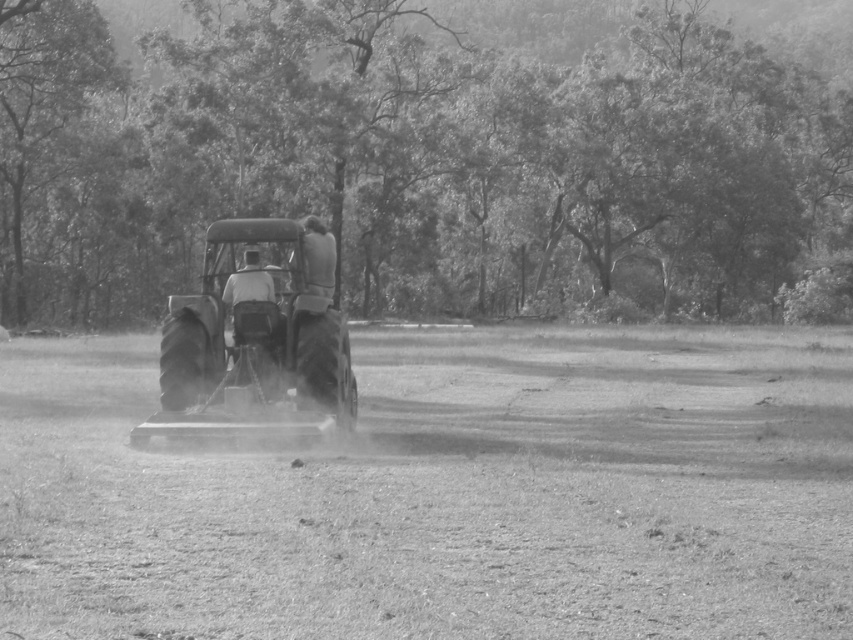
You are a farmer standing at the edge of your field. You see the metallic tractor at center and the dusty soil at center. Which object is taller from your viewpoint?

The metallic tractor at center is taller than the dusty soil at center.

From the picture: You are standing in the field and want to take a photo of the metallic tractor at center. If your camera has a maximum focus range of 40 feet, will you need to move closer to capture a clear image?

The metallic tractor at center is 43.28 feet away from the camera, which exceeds the maximum focus range of 40 feet. Therefore, you need to move closer to ensure the tractor is in focus.

You are a drone operator trying to capture a photo of the tractor and its two occupants. The drone is currently hovering above the dusty soil at center. To get a clear shot, you need to move the drone either north or south. Based on the scene description, which direction should you move the drone to ensure the tractor is fully visible in the frame?

The dusty soil at center is located at point (447,493). Since the tractor is in the foreground and the trees are in the background, moving the drone north would position it away from the trees, allowing the tractor and its occupants to be fully visible without obstruction.